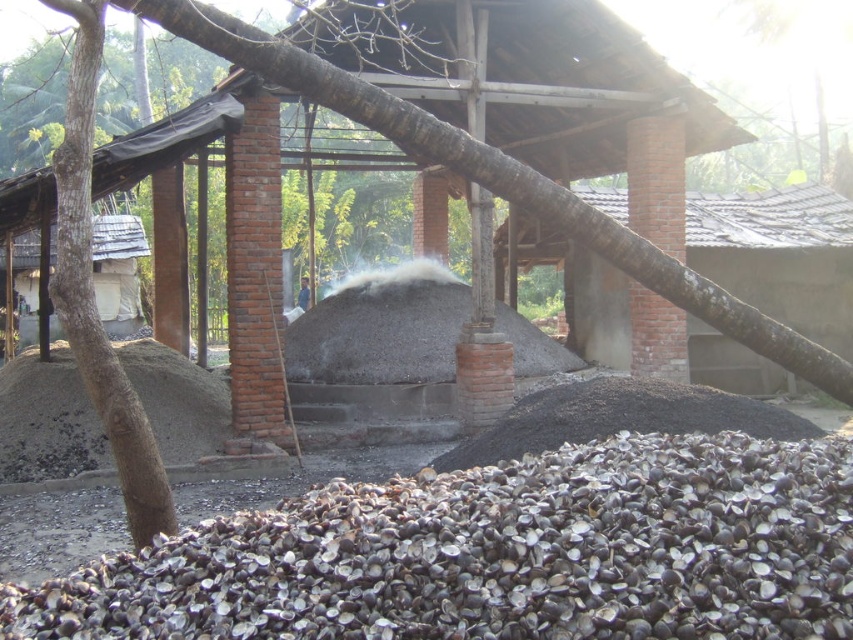
What are the coordinates of `black gravel at lower center` in the screenshot? It's located at (500, 554).

Does black gravel at lower center have a greater height compared to gray concrete mound at center?

Incorrect, black gravel at lower center's height is not larger of gray concrete mound at center's.

What do you see at coordinates (500, 554) in the screenshot? I see `black gravel at lower center` at bounding box center [500, 554].

Locate an element on the screen. The height and width of the screenshot is (640, 853). black gravel at lower center is located at coordinates (500, 554).

Does black gravel at lower center have a lesser width compared to black gravel pile at lower right?

No.

From the picture: Is black gravel at lower center below black gravel pile at lower right?

Yes, black gravel at lower center is below black gravel pile at lower right.

This screenshot has height=640, width=853. Describe the element at coordinates (500, 554) in the screenshot. I see `black gravel at lower center` at that location.

Locate an element on the screen. black gravel at lower center is located at coordinates (500, 554).

Which is more to the right, gray concrete mound at center or black gravel pile at lower right?

From the viewer's perspective, black gravel pile at lower right appears more on the right side.

Is gray concrete mound at center closer to the viewer compared to black gravel pile at lower right?

That is False.

What are the coordinates of `gray concrete mound at center` in the screenshot? It's located at (381, 332).